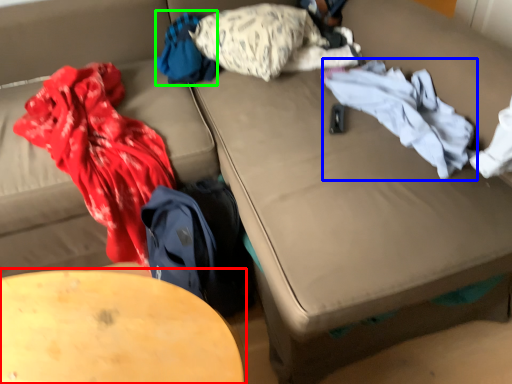
Question: Which object is positioned closest to table (highlighted by a red box)? Select from clothing (highlighted by a blue box) and clothing (highlighted by a green box).

Choices:
 (A) clothing
 (B) clothing

Answer: (A)